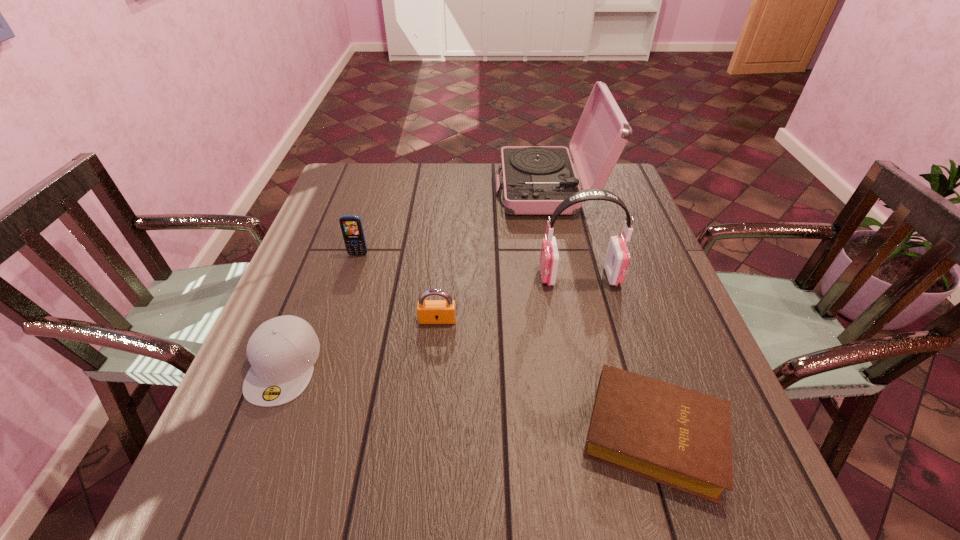
You are a GUI agent. You are given a task and a screenshot of the screen. Output one action in this format:
    pyautogui.click(x=<x>, y=<y>)
    Task: Click on the free space at the left edge of the desktop
    The height and width of the screenshot is (540, 960).
    Given the screenshot: What is the action you would take?
    pyautogui.click(x=252, y=434)

Locate an element on the screen. This screenshot has width=960, height=540. vacant area at the right edge is located at coordinates (584, 210).

Image resolution: width=960 pixels, height=540 pixels. I want to click on vacant space at the far left corner of the desktop, so [x=350, y=167].

Locate an element on the screen. vacant space at the far right corner of the desktop is located at coordinates (598, 201).

The image size is (960, 540). Find the location of `vacant space at the near right corner`. vacant space at the near right corner is located at coordinates (753, 529).

Where is `vacant area between the cellular telephone and the fifth shortest object`? The height and width of the screenshot is (540, 960). vacant area between the cellular telephone and the fifth shortest object is located at coordinates (468, 265).

The width and height of the screenshot is (960, 540). I want to click on free space between the cellular telephone and the Bible, so tap(506, 345).

Find the location of `free space between the cap and the fifth nearest object`. free space between the cap and the fifth nearest object is located at coordinates (321, 309).

The height and width of the screenshot is (540, 960). Identify the location of free spot between the second tallest object and the Bible. (616, 355).

At what (x,y) coordinates should I click in order to perform the action: click on free spot between the second tallest object and the second farthest object. Please return your answer as a coordinate pair (x, y). Looking at the image, I should click on (468, 265).